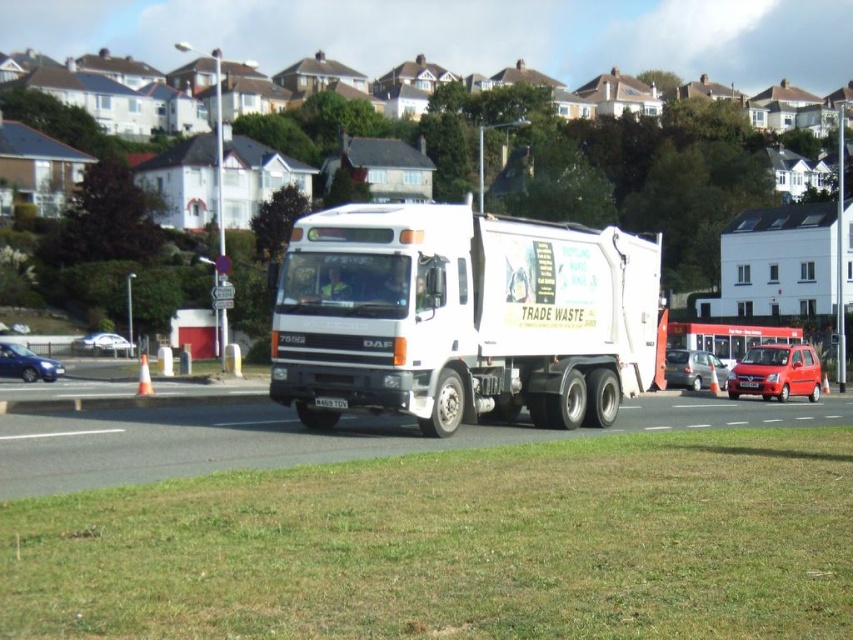
Does white matte truck at center appear under white plastic license plate at center?

Actually, white matte truck at center is above white plastic license plate at center.

Between white matte truck at center and white plastic license plate at center, which one is positioned lower?

white plastic license plate at center is below.

Is point (540, 360) closer to camera compared to point (329, 396)?

That is False.

Find the location of a particular element. white matte truck at center is located at coordinates (462, 316).

Is shiny silver sedan at left taller than black plastic license plate at center?

Yes.

Does shiny silver sedan at left appear on the right side of black plastic license plate at center?

Incorrect, shiny silver sedan at left is not on the right side of black plastic license plate at center.

The image size is (853, 640). What do you see at coordinates (103, 344) in the screenshot?
I see `shiny silver sedan at left` at bounding box center [103, 344].

Locate an element on the screen. The height and width of the screenshot is (640, 853). shiny silver sedan at left is located at coordinates (103, 344).

Can you confirm if shiny red van at center is smaller than white plastic license plate at center?

No, shiny red van at center is not smaller than white plastic license plate at center.

Can you confirm if shiny red van at center is positioned below white plastic license plate at center?

Indeed, shiny red van at center is positioned under white plastic license plate at center.

Who is more distant from viewer, (819, 378) or (346, 406)?

The point (819, 378) is behind.

The image size is (853, 640). I want to click on shiny red van at center, so click(776, 371).